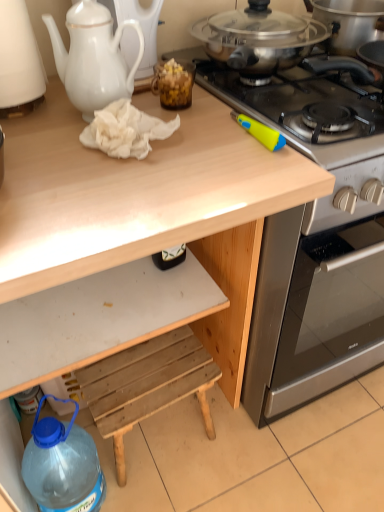
You are a GUI agent. You are given a task and a screenshot of the screen. Output one action in this format:
    pyautogui.click(x=<x>, y=<y>)
    Task: Click on the vacant space to the right of white porcelain teapot at upper left
    The image size is (384, 512).
    Given the screenshot: What is the action you would take?
    pyautogui.click(x=206, y=123)